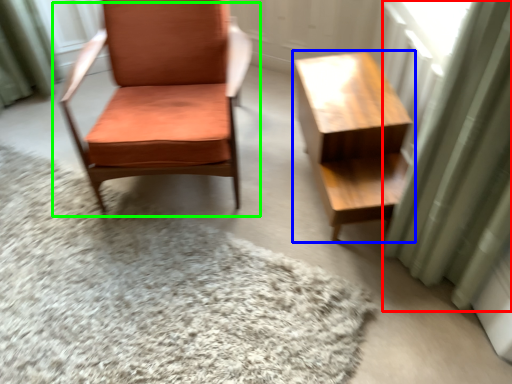
Question: Which is farther away from curtain (highlighted by a red box)? table (highlighted by a blue box) or chair (highlighted by a green box)?

Choices:
 (A) table
 (B) chair

Answer: (B)